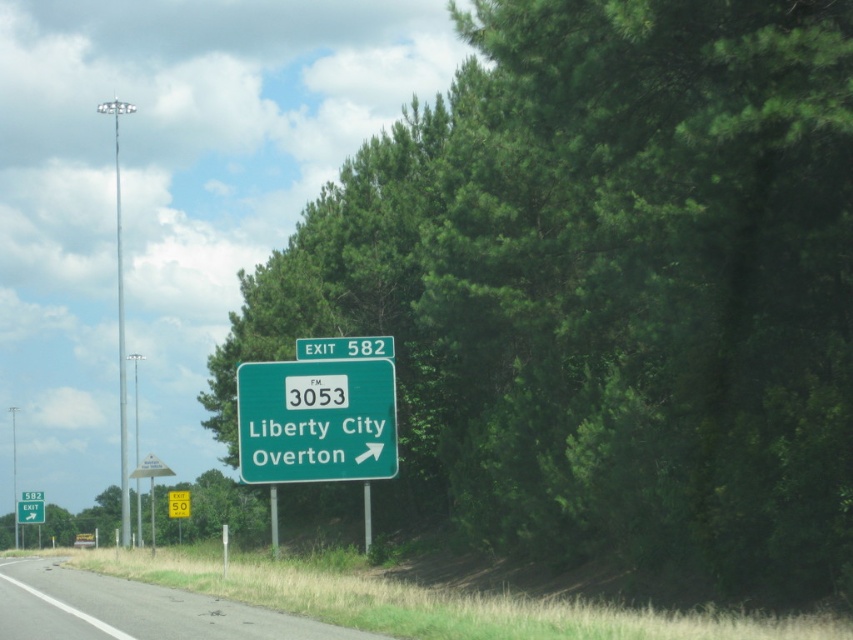
Does gray asphalt road at lower left have a greater width compared to green matte sign at center?

Correct, the width of gray asphalt road at lower left exceeds that of green matte sign at center.

The width and height of the screenshot is (853, 640). I want to click on gray asphalt road at lower left, so click(134, 609).

Where is `gray asphalt road at lower left`? The width and height of the screenshot is (853, 640). gray asphalt road at lower left is located at coordinates (134, 609).

Is green leafy tree at center below gray asphalt road at lower left?

No, green leafy tree at center is not below gray asphalt road at lower left.

Does green leafy tree at center appear on the right side of gray asphalt road at lower left?

Yes, green leafy tree at center is to the right of gray asphalt road at lower left.

Find the location of a particular element. The height and width of the screenshot is (640, 853). green leafy tree at center is located at coordinates (606, 285).

This screenshot has width=853, height=640. What are the coordinates of `green leafy tree at lower left` in the screenshot? It's located at (215, 509).

Describe the element at coordinates (215, 509) in the screenshot. I see `green leafy tree at lower left` at that location.

Locate an element on the screen. This screenshot has width=853, height=640. green leafy tree at lower left is located at coordinates (215, 509).